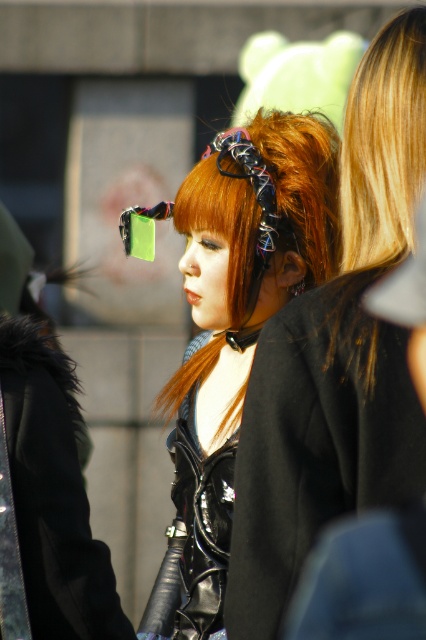
You are a fashion stylist trying to choose between the shiny black leather jacket at center and the black leather coat at center for a client. Which one is bigger?

The shiny black leather jacket at center is larger in size compared to the black leather coat at center.

You are a photographer trying to capture the person wearing both the shiny black leather jacket at center and the black leather coat at center. Since you want to ensure both items are clearly visible in the photo, which one should you focus on first to make sure it is in sharp focus?

The shiny black leather jacket at center is closer to the viewer than the black leather coat at center, so focusing on the shiny black leather jacket at center first will ensure both are in focus as it is the foreground object.